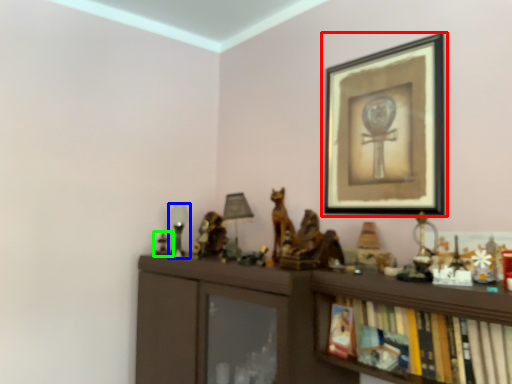
Question: Which is nearer to the picture frame (highlighted by a red box)? table lamp (highlighted by a blue box) or toy (highlighted by a green box).

Choices:
 (A) table lamp
 (B) toy

Answer: (A)